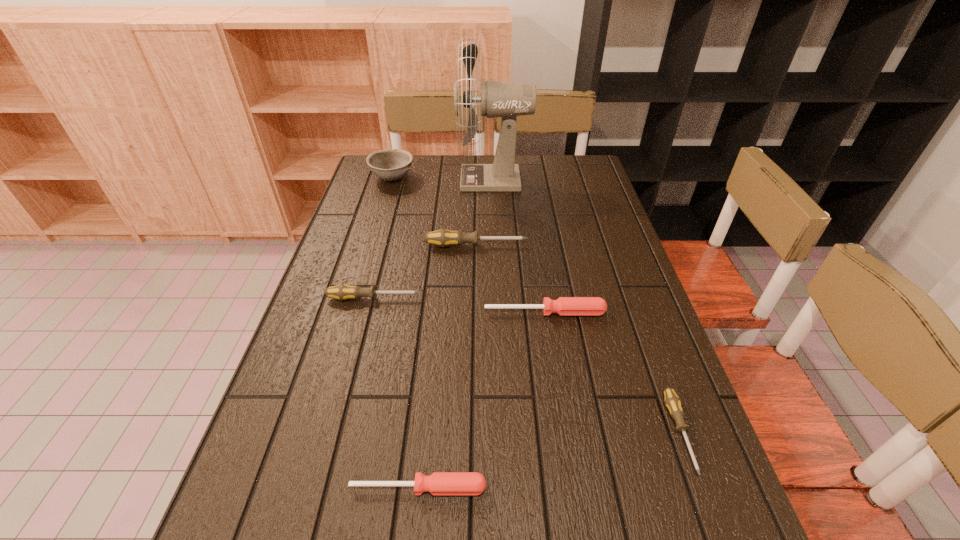
Where is `the closest object to the second farthest screwdriver`? Image resolution: width=960 pixels, height=540 pixels. the closest object to the second farthest screwdriver is located at coordinates (564, 306).

Where is `screwdriver that can be found as the second closest to the right red screwdriver`? screwdriver that can be found as the second closest to the right red screwdriver is located at coordinates (674, 404).

The width and height of the screenshot is (960, 540). I want to click on screwdriver identified as the fourth closest to the rightmost gray screwdriver, so click(x=342, y=292).

Locate which gray screwdriver ranks second in proximity to the sixth shortest object. Please provide its 2D coordinates. Your answer should be formatted as a tuple, i.e. [(x, y)], where the tuple contains the x and y coordinates of a point satisfying the conditions above.

[(342, 292)]

Find the location of `the third closest gray screwdriver to the tallest object`. the third closest gray screwdriver to the tallest object is located at coordinates (674, 404).

Find the location of a particular element. This screenshot has height=540, width=960. red screwdriver that can be found as the closest to the nearest gray screwdriver is located at coordinates (564, 306).

Select which red screwdriver appears as the closest to the sixth shortest object. Please provide its 2D coordinates. Your answer should be formatted as a tuple, i.e. [(x, y)], where the tuple contains the x and y coordinates of a point satisfying the conditions above.

[(564, 306)]

You are a GUI agent. You are given a task and a screenshot of the screen. Output one action in this format:
    pyautogui.click(x=<x>, y=<y>)
    Task: Click on the blank area in the image that satisfies the following two spatial constraints: 1. on the back side of the fifth farthest object; 2. at the tip of the fifth shortest object
    The width and height of the screenshot is (960, 540).
    Given the screenshot: What is the action you would take?
    pyautogui.click(x=535, y=245)